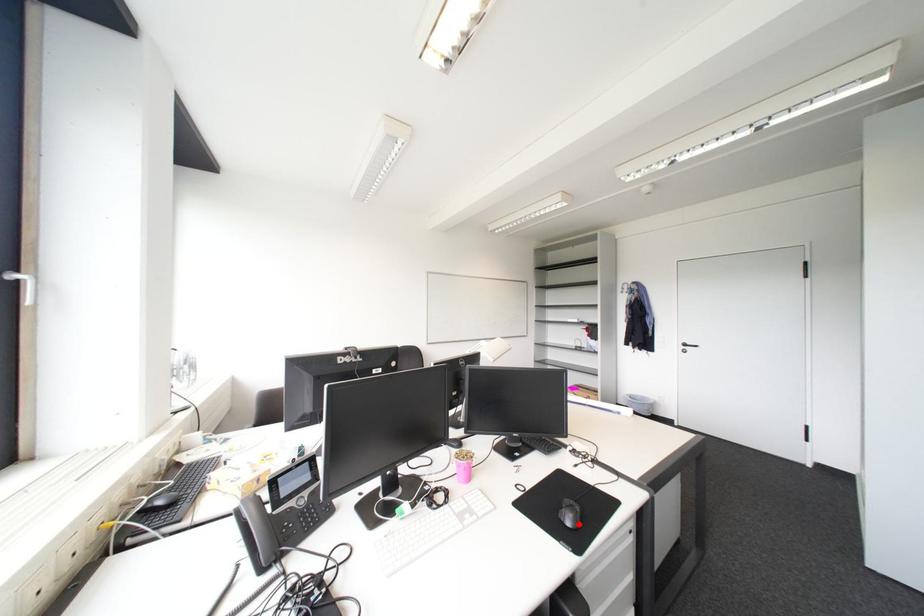
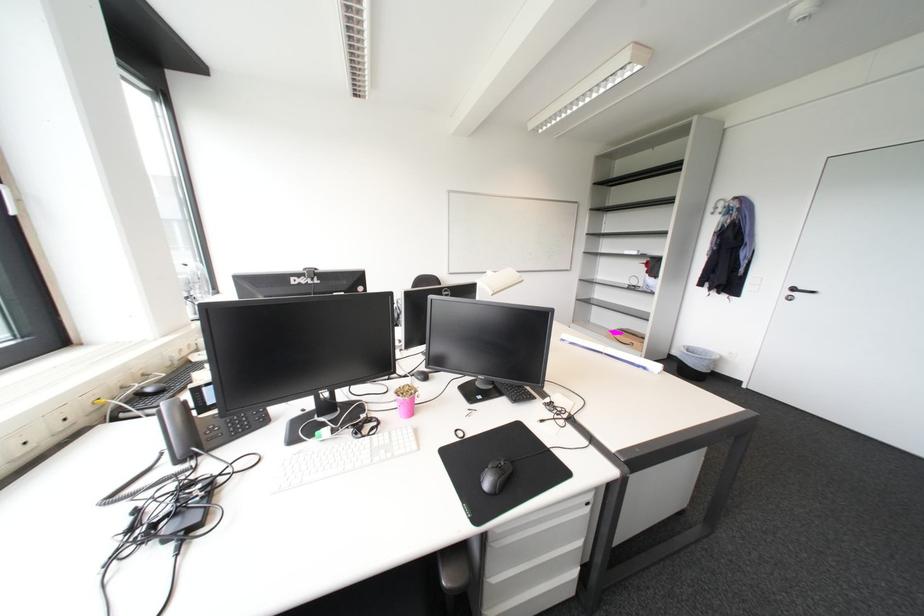
Find the pixel in the second image that matches the highlighted location in the first image.

(496, 485)